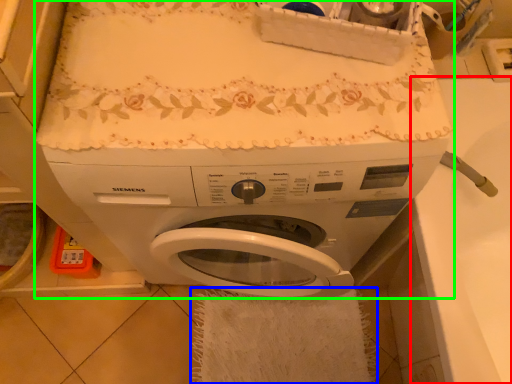
Question: Which is farther away from counter top (highlighted by a red box)? bath towel (highlighted by a blue box) or washing machine (highlighted by a green box)?

Choices:
 (A) bath towel
 (B) washing machine

Answer: (A)